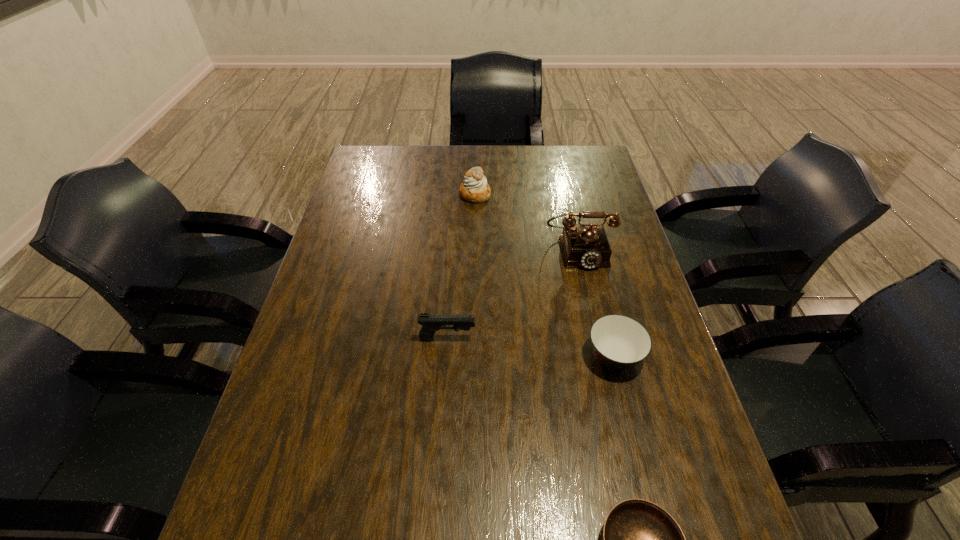
Identify the location of the tallest object. (586, 246).

Identify the location of telephone. The image size is (960, 540). (586, 246).

The width and height of the screenshot is (960, 540). In order to click on the farthest object in this screenshot , I will do `click(475, 189)`.

This screenshot has width=960, height=540. Find the location of `pistol`. pistol is located at coordinates (431, 323).

Where is `the farther soup bowl`? the farther soup bowl is located at coordinates (619, 342).

At what (x,y) coordinates should I click in order to perform the action: click on the fourth tallest object. Please return your answer as a coordinate pair (x, y). The width and height of the screenshot is (960, 540). Looking at the image, I should click on pos(619,342).

Where is `free spot located on the dial of the fourth nearest object`? The image size is (960, 540). free spot located on the dial of the fourth nearest object is located at coordinates (601, 347).

This screenshot has width=960, height=540. I want to click on free space located 0.290m on the front of the farthest object, so click(x=474, y=265).

This screenshot has height=540, width=960. What are the coordinates of `free space located 0.210m at the barrel of the pistol` in the screenshot? It's located at (561, 339).

Where is `free space located 0.360m on the left of the farther soup bowl`? This screenshot has height=540, width=960. free space located 0.360m on the left of the farther soup bowl is located at coordinates (434, 357).